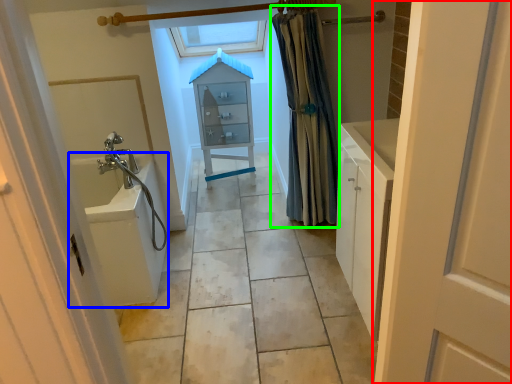
Question: Which is nearer to the door (highlighted by a red box)? bath (highlighted by a blue box) or shower curtain (highlighted by a green box).

Choices:
 (A) bath
 (B) shower curtain

Answer: (A)